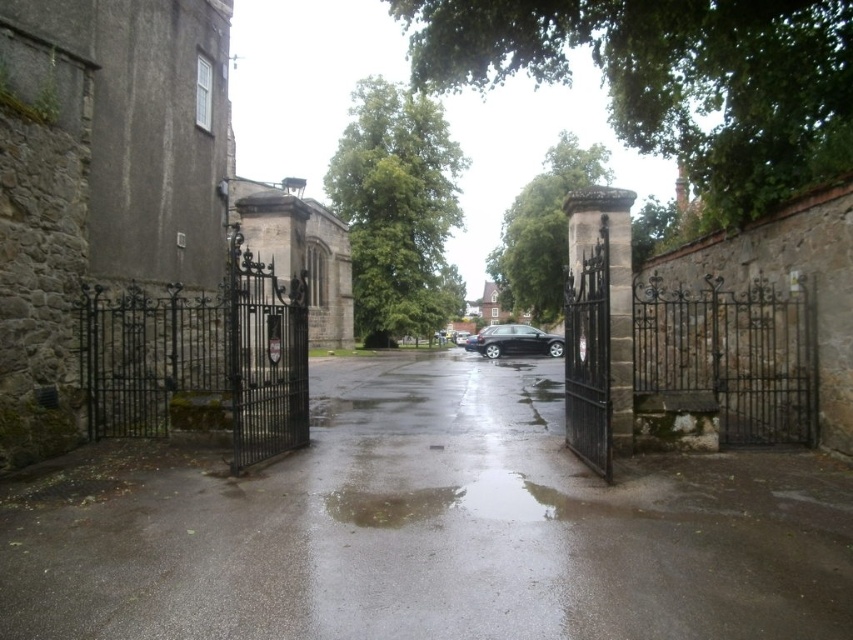
You are driving a glossy black car at center that is 1.8 meters wide. You need to navigate through the glossy asphalt alley at center. Can your car fit through the alley?

The glossy asphalt alley at center might be wider than glossy black car at center, so there is a possibility that the car can fit through the alley. However, the exact width is uncertain based on the provided information.

You are driving a car and want to park it in the alley. Based on the image, can you determine if the glossy black car at center will fit into the glossy asphalt alley at center?

The glossy asphalt alley at center is below the glossy black car at center, which means the alley is positioned lower than the car. Since the alley is below the car, the car can be driven down into the alley and should fit as long as there are no other obstructions.

You are driving a car and want to enter the alley. Based on the image, can you determine if the glossy black car at center is blocking the glossy asphalt alley at center?

The glossy asphalt alley at center is in front of the glossy black car at center, so the glossy black car at center is not blocking the alley. You can proceed safely.